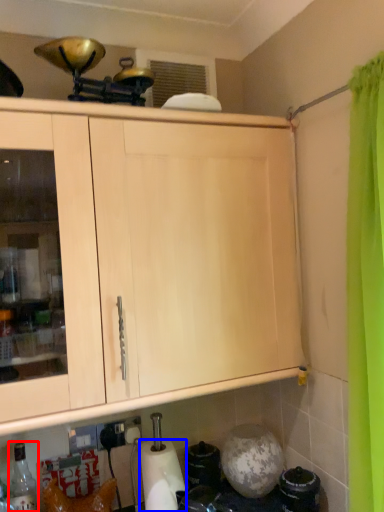
Question: Among these objects, which one is nearest to the camera, bottle (highlighted by a red box) or paper towel (highlighted by a blue box)?

Choices:
 (A) bottle
 (B) paper towel

Answer: (A)